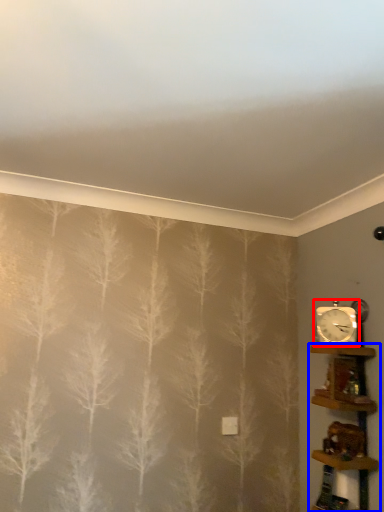
Question: Which object is further to the camera taking this photo, clock (highlighted by a red box) or shelf (highlighted by a blue box)?

Choices:
 (A) clock
 (B) shelf

Answer: (A)